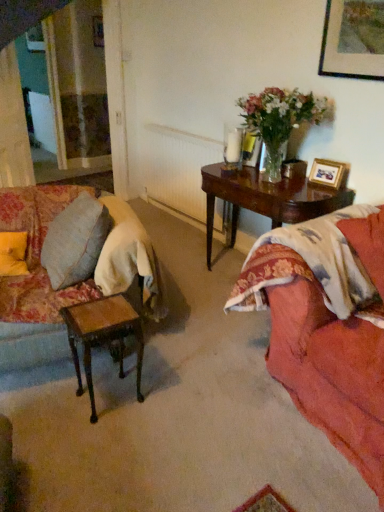
Question: Does wooden picture frame at upper right come in front of translucent glass vase at upper right?

Choices:
 (A) no
 (B) yes

Answer: (A)

Question: From the image's perspective, is wooden picture frame at upper right over translucent glass vase at upper right?

Choices:
 (A) no
 (B) yes

Answer: (A)

Question: Is wooden picture frame at upper right completely or partially outside of translucent glass vase at upper right?

Choices:
 (A) no
 (B) yes

Answer: (B)

Question: From a real-world perspective, is wooden picture frame at upper right on translucent glass vase at upper right?

Choices:
 (A) no
 (B) yes

Answer: (A)

Question: From a real-world perspective, is wooden picture frame at upper right under translucent glass vase at upper right?

Choices:
 (A) yes
 (B) no

Answer: (A)

Question: Is wooden picture frame at upper right shorter than translucent glass vase at upper right?

Choices:
 (A) yes
 (B) no

Answer: (A)

Question: Is velvet floral couch at left thinner than floral fabric bedspread at right?

Choices:
 (A) yes
 (B) no

Answer: (A)

Question: From the image's perspective, does velvet floral couch at left appear higher than floral fabric bedspread at right?

Choices:
 (A) no
 (B) yes

Answer: (B)

Question: Does velvet floral couch at left have a greater height compared to floral fabric bedspread at right?

Choices:
 (A) yes
 (B) no

Answer: (B)

Question: From a real-world perspective, does velvet floral couch at left stand above floral fabric bedspread at right?

Choices:
 (A) no
 (B) yes

Answer: (A)

Question: Is velvet floral couch at left further to camera compared to floral fabric bedspread at right?

Choices:
 (A) yes
 (B) no

Answer: (A)

Question: Can you confirm if velvet floral couch at left is smaller than floral fabric bedspread at right?

Choices:
 (A) yes
 (B) no

Answer: (A)

Question: Does light beige fabric curtain at left appear on the right side of velvet floral couch at left?

Choices:
 (A) yes
 (B) no

Answer: (B)